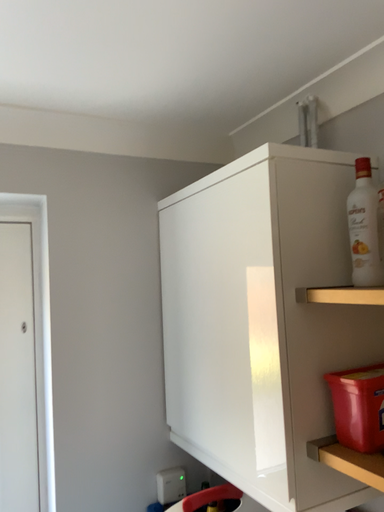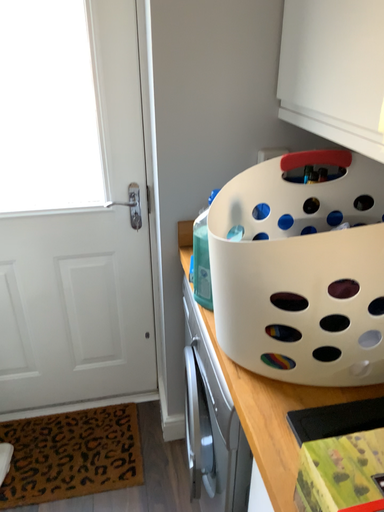
Question: Which way did the camera rotate in the video?

Choices:
 (A) rotated upward
 (B) rotated downward

Answer: (B)